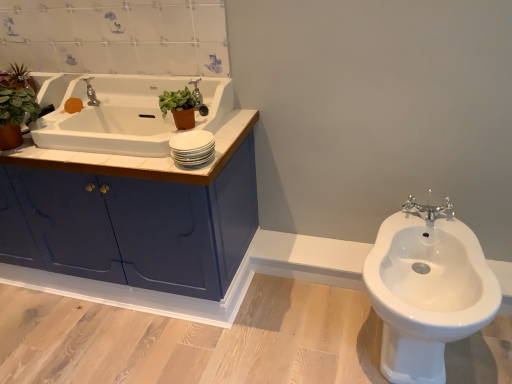
At what (x,y) coordinates should I click in order to perform the action: click on blank area to the left of white glossy bidet at right. Please return your answer as a coordinate pair (x, y). The width and height of the screenshot is (512, 384). Looking at the image, I should click on (295, 332).